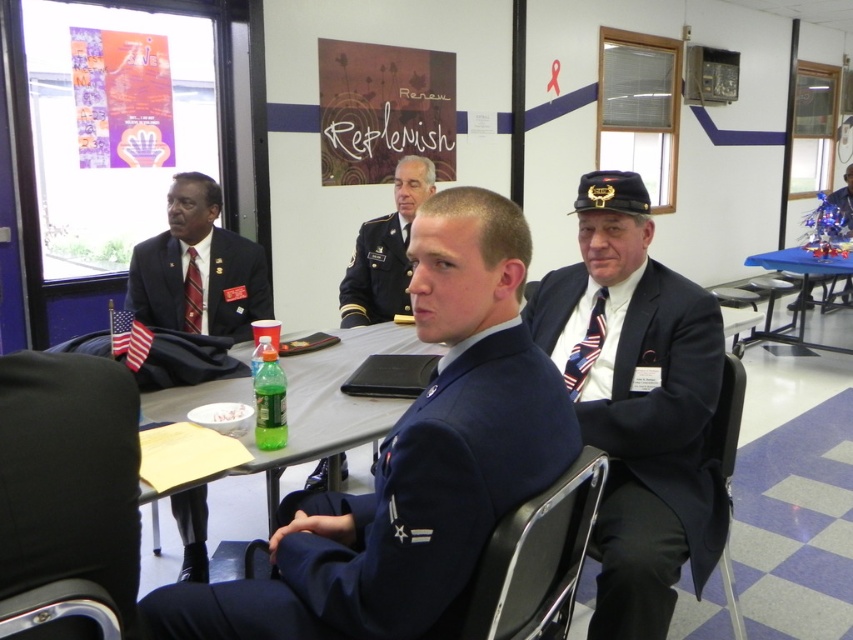
Between clear plastic bottle at center and american flag patterned tie at right, which one has less height?

Standing shorter between the two is american flag patterned tie at right.

Does clear plastic bottle at center appear under american flag patterned tie at right?

Yes.

What do you see at coordinates (326, 412) in the screenshot? I see `clear plastic bottle at center` at bounding box center [326, 412].

This screenshot has height=640, width=853. I want to click on clear plastic bottle at center, so click(x=326, y=412).

Is blue uniform at center above blue silk tie at center?

Incorrect, blue uniform at center is not positioned above blue silk tie at center.

Which is behind, point (372, 314) or point (403, 237)?

The point (372, 314) is behind.

Which is in front, point (358, 234) or point (407, 234)?

Point (407, 234) is in front.

Locate an element on the screen. blue uniform at center is located at coordinates (384, 252).

Is clear plastic bottle at center positioned behind metallic gray chair at lower left?

Yes.

Where is `clear plastic bottle at center`? The image size is (853, 640). clear plastic bottle at center is located at coordinates (326, 412).